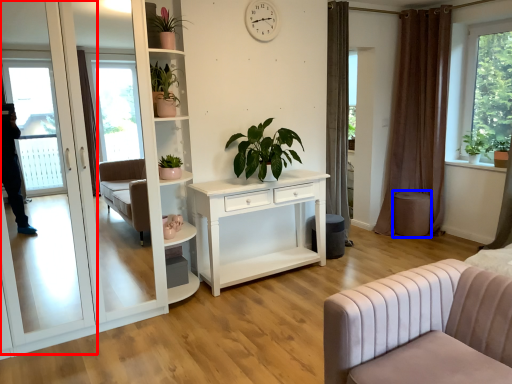
Question: Which object appears farthest to the camera in this image, screen door (highlighted by a red box) or stool (highlighted by a blue box)?

Choices:
 (A) screen door
 (B) stool

Answer: (B)